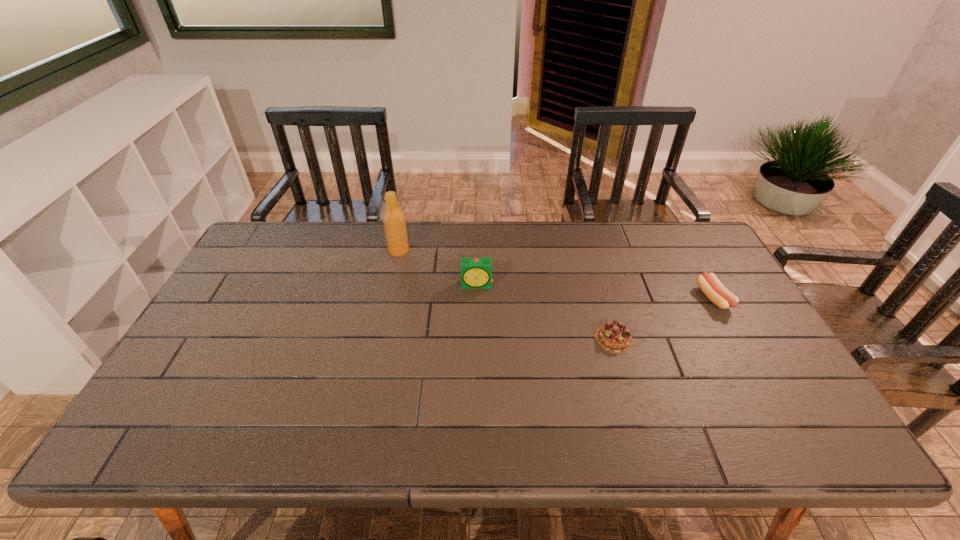
Locate an element on the screen. The height and width of the screenshot is (540, 960). object that stands as the third closest to the third shortest object is located at coordinates (714, 290).

Identify which object is the third nearest to the second object from right to left. Please provide its 2D coordinates. Your answer should be formatted as a tuple, i.e. [(x, y)], where the tuple contains the x and y coordinates of a point satisfying the conditions above.

[(394, 221)]

Where is `vacant space that satisfies the following two spatial constraints: 1. on the front-facing side of the rightmost object; 2. on the right side of the alarm clock`? The width and height of the screenshot is (960, 540). vacant space that satisfies the following two spatial constraints: 1. on the front-facing side of the rightmost object; 2. on the right side of the alarm clock is located at coordinates (477, 299).

Locate an element on the screen. This screenshot has width=960, height=540. free location that satisfies the following two spatial constraints: 1. on the front side of the leftmost object; 2. on the left side of the rightmost object is located at coordinates (389, 299).

This screenshot has width=960, height=540. What are the coordinates of `free spot that satisfies the following two spatial constraints: 1. on the front-facing side of the nearest object; 2. on the left side of the alarm clock` in the screenshot? It's located at (476, 339).

Where is `free region that satisfies the following two spatial constraints: 1. on the front-facing side of the rightmost object; 2. on the right side of the second tallest object`? The image size is (960, 540). free region that satisfies the following two spatial constraints: 1. on the front-facing side of the rightmost object; 2. on the right side of the second tallest object is located at coordinates (477, 299).